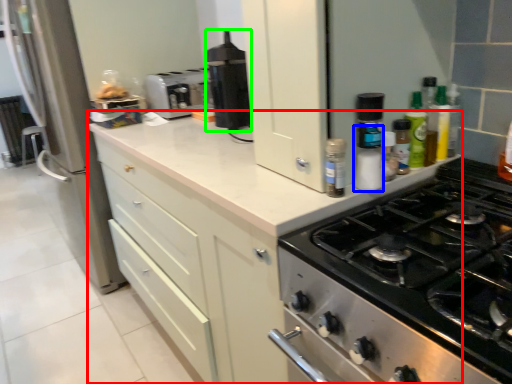
Question: Which is farther away from cabinetry (highlighted by a red box)? bottle (highlighted by a blue box) or kitchen appliance (highlighted by a green box)?

Choices:
 (A) bottle
 (B) kitchen appliance

Answer: (A)